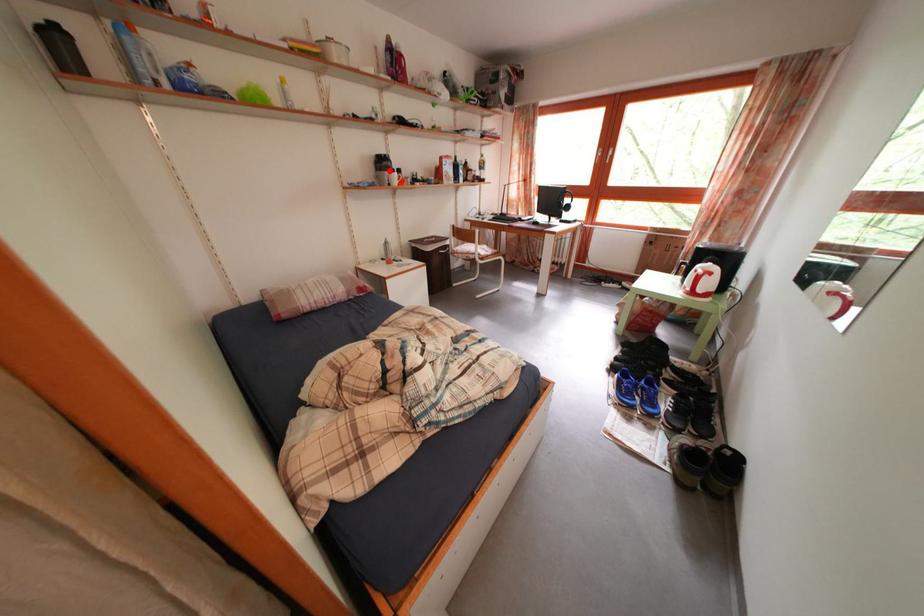
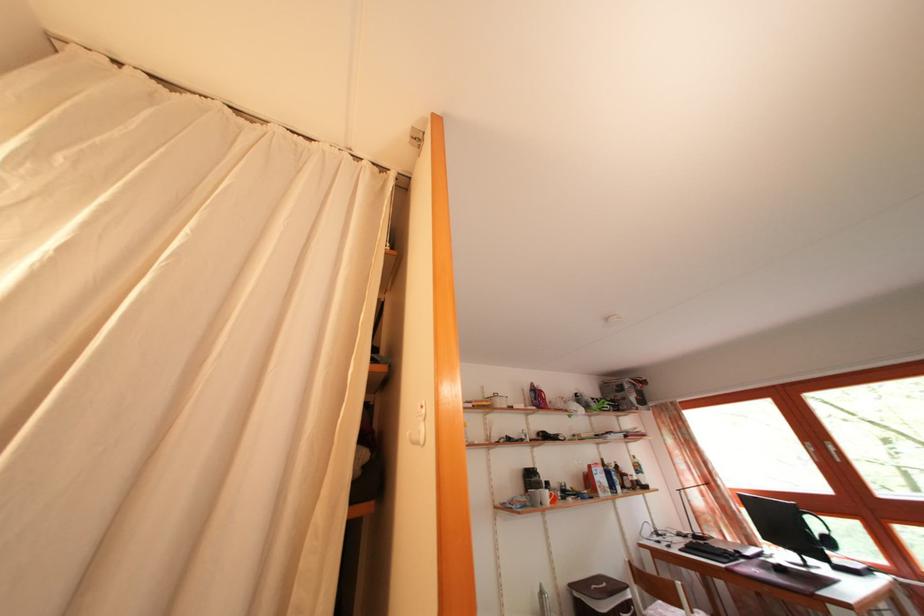
Question: I am providing you with two images of the same scene from different viewpoints. A red point is shown in image1. For the corresponding object point in image2, is it positioned nearer or farther from the camera?

Choices:
 (A) Nearer
 (B) Farther

Answer: (B)